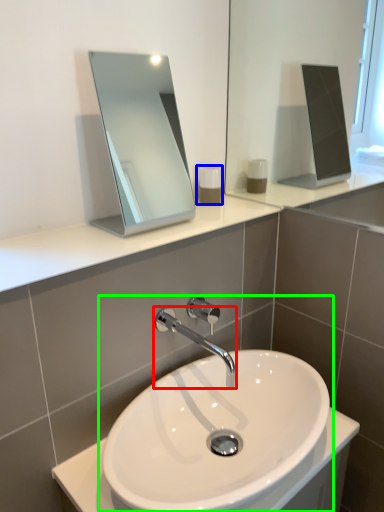
Question: Estimate the real-world distances between objects in this image. Which object is closer to tap (highlighted by a red box), soap dispenser (highlighted by a blue box) or sink (highlighted by a green box)?

Choices:
 (A) soap dispenser
 (B) sink

Answer: (B)